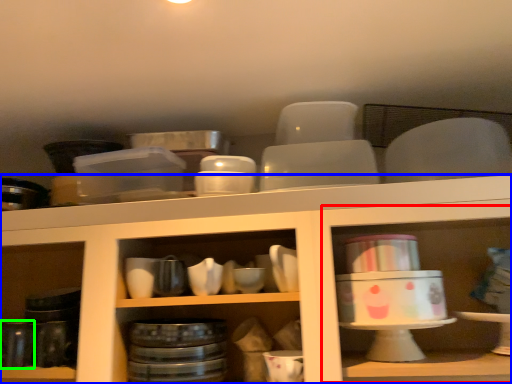
Question: Based on their relative distances, which object is nearer to shelf (highlighted by a red box)? Choose from shelf (highlighted by a blue box) and tableware (highlighted by a green box).

Choices:
 (A) shelf
 (B) tableware

Answer: (A)